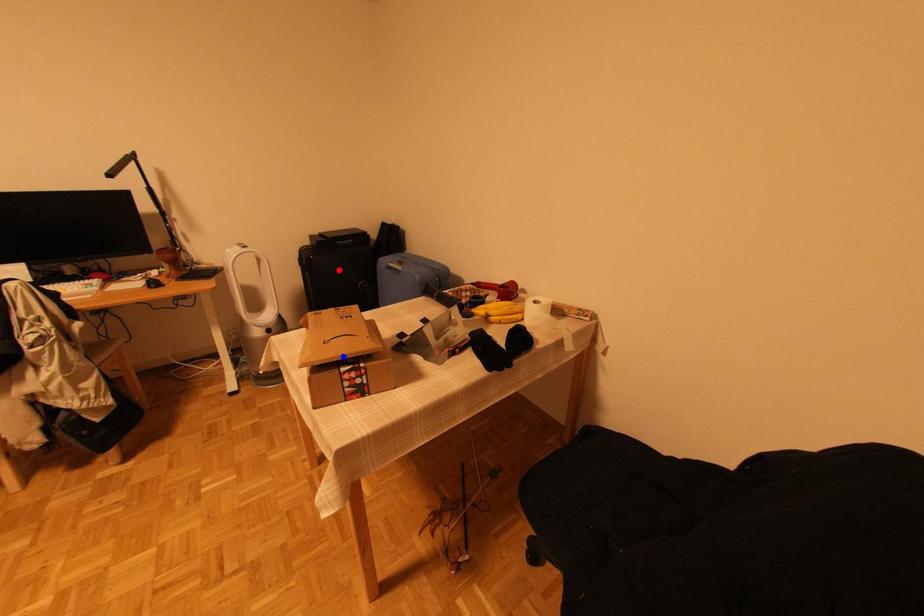
Question: Which of the two points in the image is closer to the camera?

Choices:
 (A) Blue point is closer.
 (B) Red point is closer.

Answer: (A)